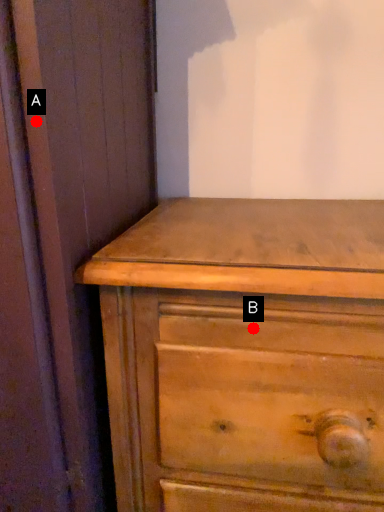
Question: Two points are circled on the image, labeled by A and B beside each circle. Which point is closer to the camera?

Choices:
 (A) A is closer
 (B) B is closer

Answer: (A)